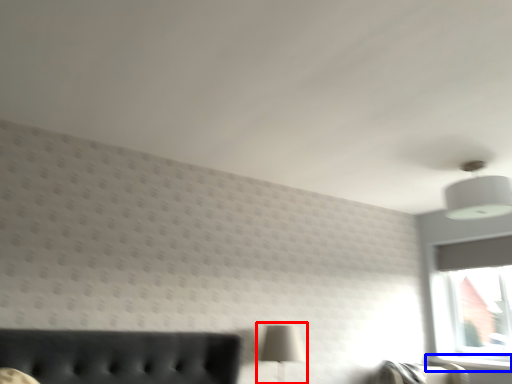
Question: Which object is further to the camera taking this photo, table lamp (highlighted by a red box) or window sill (highlighted by a blue box)?

Choices:
 (A) table lamp
 (B) window sill

Answer: (B)